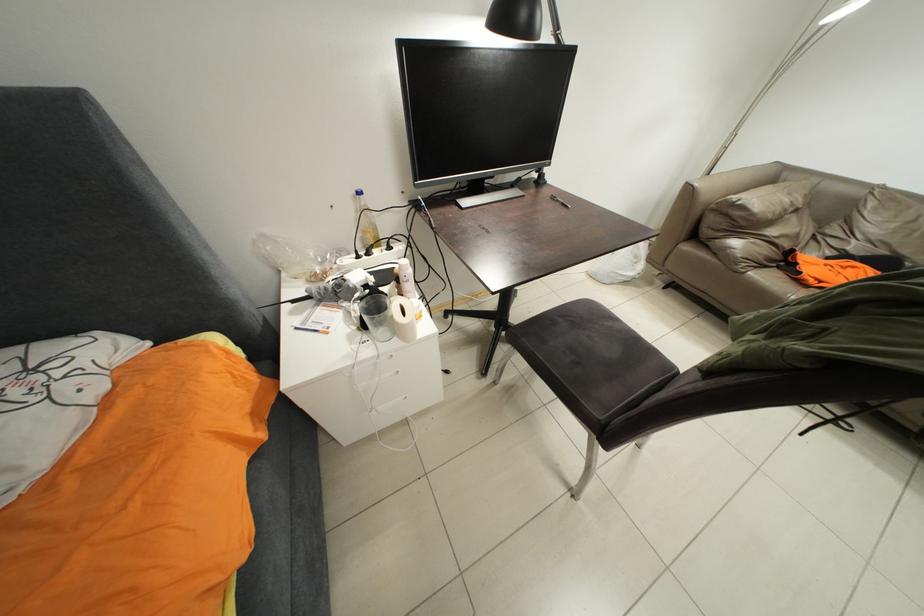
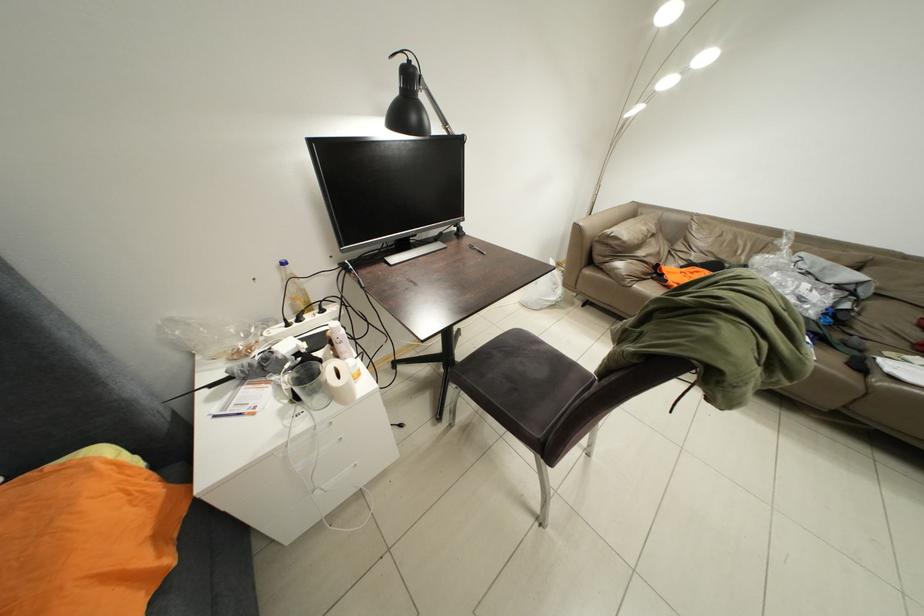
What movement of the cameraman would produce the second image?

The cameraman moved toward right, backward.